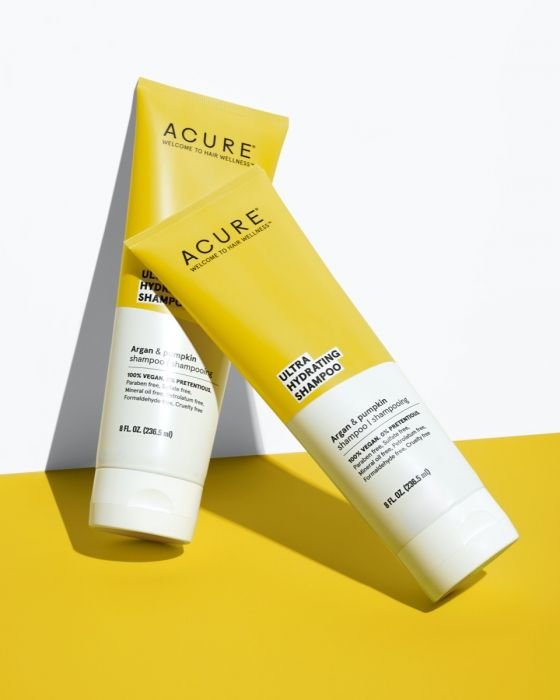
The width and height of the screenshot is (560, 700). What are the coordinates of `yellow floor` in the screenshot? It's located at (461, 638).